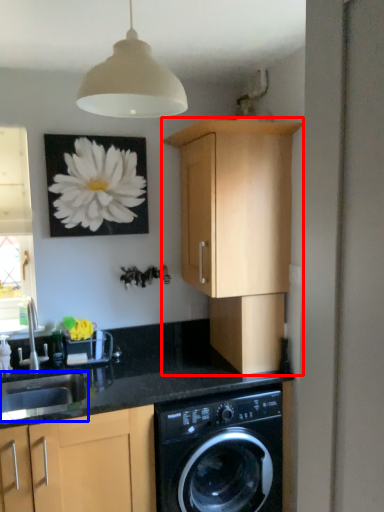
Question: Which point is closer to the camera, cabinetry (highlighted by a red box) or sink (highlighted by a blue box)?

Choices:
 (A) cabinetry
 (B) sink

Answer: (A)